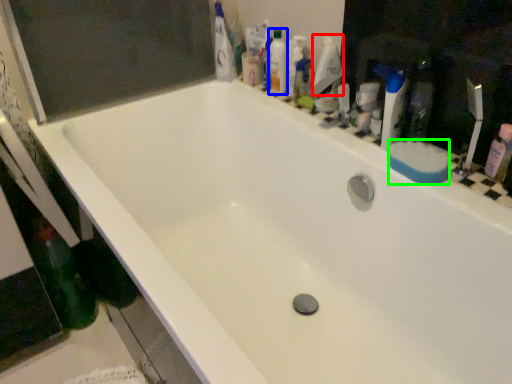
Question: Which is nearer to the cleaning product (highlighted by a red box)? mouthwash (highlighted by a blue box) or soap (highlighted by a green box).

Choices:
 (A) mouthwash
 (B) soap

Answer: (A)